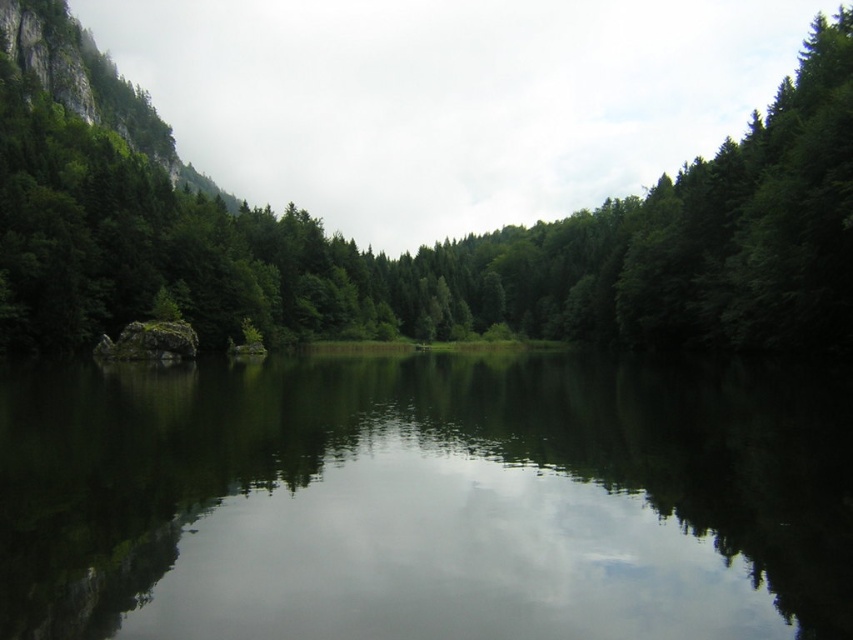
You are standing at the edge of the scene and want to take a photo of the green reflective water at center and the green matte tree at center. Which object will appear closer to you in the photo?

The green reflective water at center will appear closer to you in the photo because it is in front of the green matte tree at center.

You are standing at the center of the image. Which direction should you face to see the green reflective water at center?

The green reflective water at center is located at point coordinates of 0.781 on the x axis and 0.498 on the y axis. Since you are at the center of the image, facing the green reflective water at center would require facing towards the right side of the image because the x coordinate is greater than 0.5, which is the center point on the x axis.

You are standing on the shore looking at the green reflective water at center and the green matte tree at center. Which object is located to the right of the other?

The green reflective water at center is positioned on the right side of green matte tree at center.